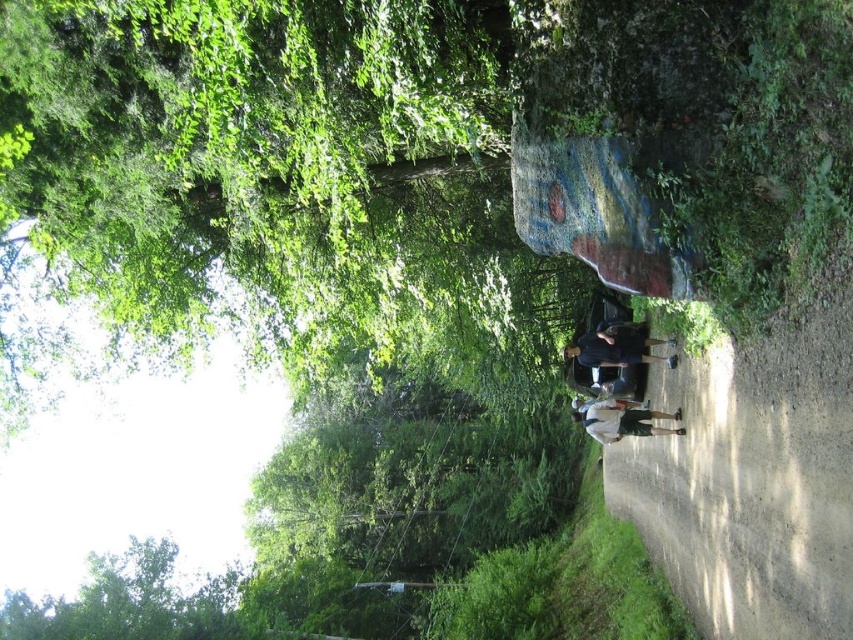
You are a hiker who wants to hang both the black matte shirt at center and the white cotton shirt at center on a single hanger. The hanger can only hold items within 30 inches combined. Can you fit both shirts on the hanger together?

The black matte shirt at center is 33.02 inches from white cotton shirt at center. Since the combined length of both shirts exceeds the hanger capacity of 30 inches, they cannot be placed together on the hanger.

You are a photographer standing on a dirt path in a forest. You notice two shirts hanging from a branch at the center of the image. The shirts are labeled as the black matte shirt at center and the white cotton shirt at center. Which shirt is shorter in height?

The black matte shirt at center is not as tall as the white cotton shirt at center, so the black matte shirt at center is shorter in height.

You are a hiker who has just arrived at the forest path and sees both the black matte shirt at center and the white cotton shirt at center. Which shirt is positioned more to the right side of the path?

The black matte shirt at center is positioned more to the right side of the path compared to the white cotton shirt at center.